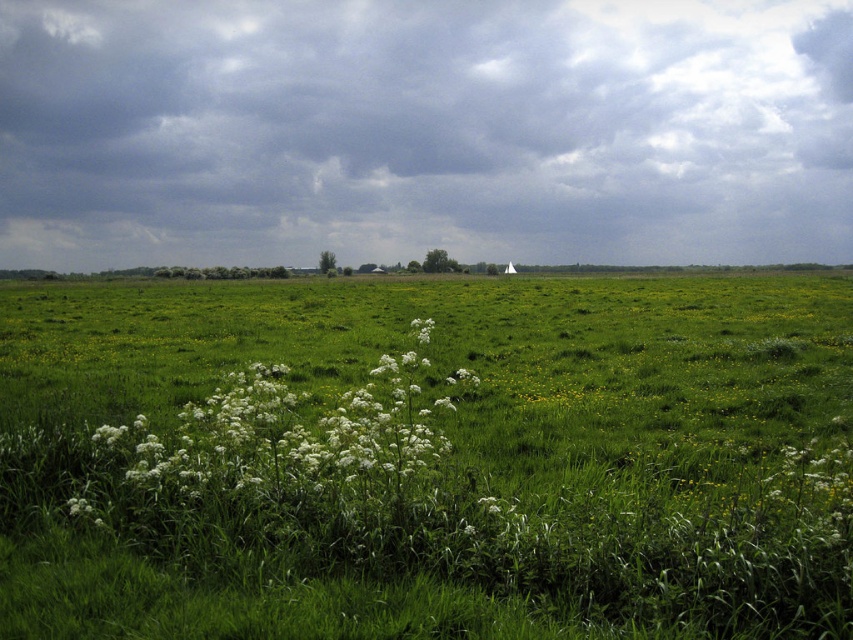
Based on the photo, who is positioned more to the left, cloudy sky at center or white fluffy plant at center?

cloudy sky at center

The width and height of the screenshot is (853, 640). Describe the element at coordinates (424, 131) in the screenshot. I see `cloudy sky at center` at that location.

The width and height of the screenshot is (853, 640). In order to click on cloudy sky at center in this screenshot , I will do `click(424, 131)`.